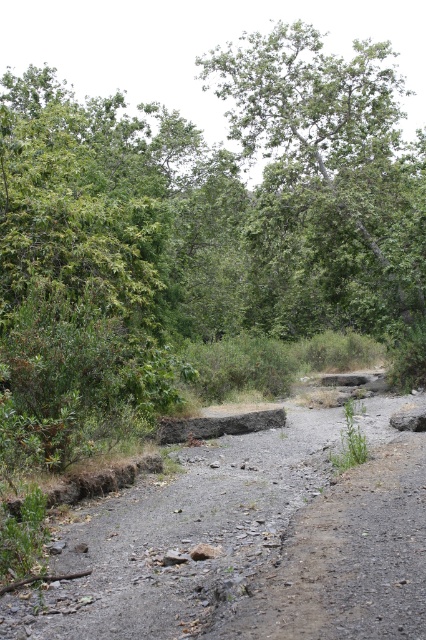
What do you see at coordinates (250, 541) in the screenshot? I see `dull gray gravel at center` at bounding box center [250, 541].

Does point (301, 406) come farther from viewer compared to point (423, 342)?

Yes, point (301, 406) is behind point (423, 342).

Is point (198, 536) positioned before point (301, 35)?

Yes.

Locate an element on the screen. The image size is (426, 640). dull gray gravel at center is located at coordinates (250, 541).